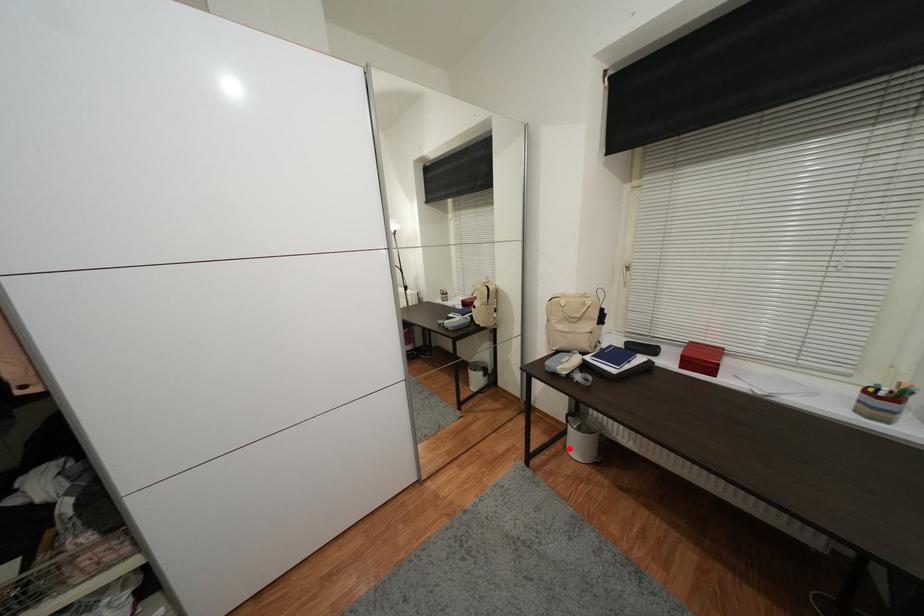
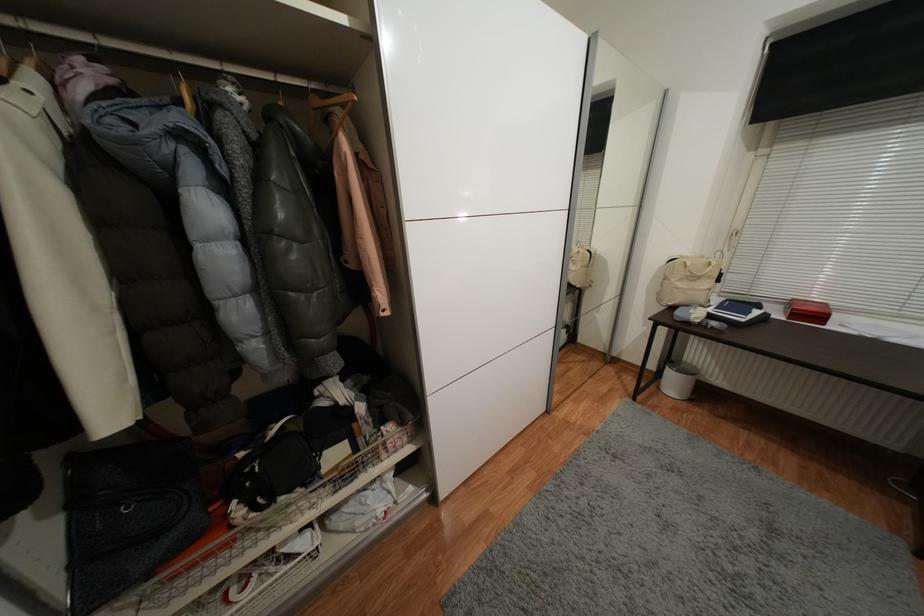
Question: I am providing you with two images of the same scene from different viewpoints. A red point is shown in image1. For the corresponding object point in image2, is it positioned nearer or farther from the camera?

Choices:
 (A) Nearer
 (B) Farther

Answer: (B)